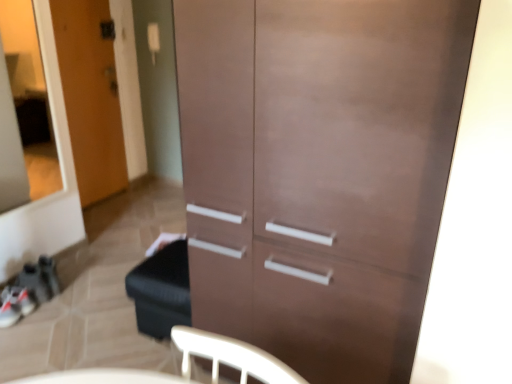
Question: Is the position of wooden door at left less distant than that of transparent glass door at upper left?

Choices:
 (A) no
 (B) yes

Answer: (A)

Question: Considering the relative sizes of wooden door at left and transparent glass door at upper left in the image provided, is wooden door at left smaller than transparent glass door at upper left?

Choices:
 (A) yes
 (B) no

Answer: (B)

Question: Considering the relative positions of wooden door at left and transparent glass door at upper left in the image provided, is wooden door at left to the left of transparent glass door at upper left from the viewer's perspective?

Choices:
 (A) no
 (B) yes

Answer: (B)

Question: From the image's perspective, does wooden door at left appear higher than transparent glass door at upper left?

Choices:
 (A) yes
 (B) no

Answer: (A)

Question: From a real-world perspective, is wooden door at left on top of transparent glass door at upper left?

Choices:
 (A) yes
 (B) no

Answer: (B)

Question: Would you say wooden door at left is a long distance from transparent glass door at upper left?

Choices:
 (A) yes
 (B) no

Answer: (B)

Question: From the image's perspective, is transparent glass door at upper left located above matte brown cabinet at center?

Choices:
 (A) no
 (B) yes

Answer: (B)

Question: Does transparent glass door at upper left appear on the left side of matte brown cabinet at center?

Choices:
 (A) yes
 (B) no

Answer: (A)

Question: Is matte brown cabinet at center surrounded by transparent glass door at upper left?

Choices:
 (A) yes
 (B) no

Answer: (B)

Question: From a real-world perspective, is transparent glass door at upper left below matte brown cabinet at center?

Choices:
 (A) no
 (B) yes

Answer: (A)

Question: Considering the relative positions of transparent glass door at upper left and matte brown cabinet at center in the image provided, is transparent glass door at upper left to the right of matte brown cabinet at center from the viewer's perspective?

Choices:
 (A) no
 (B) yes

Answer: (A)

Question: Does transparent glass door at upper left turn towards matte brown cabinet at center?

Choices:
 (A) yes
 (B) no

Answer: (A)

Question: Is matte brown cabinet at center further to the viewer compared to transparent glass door at upper left?

Choices:
 (A) no
 (B) yes

Answer: (A)